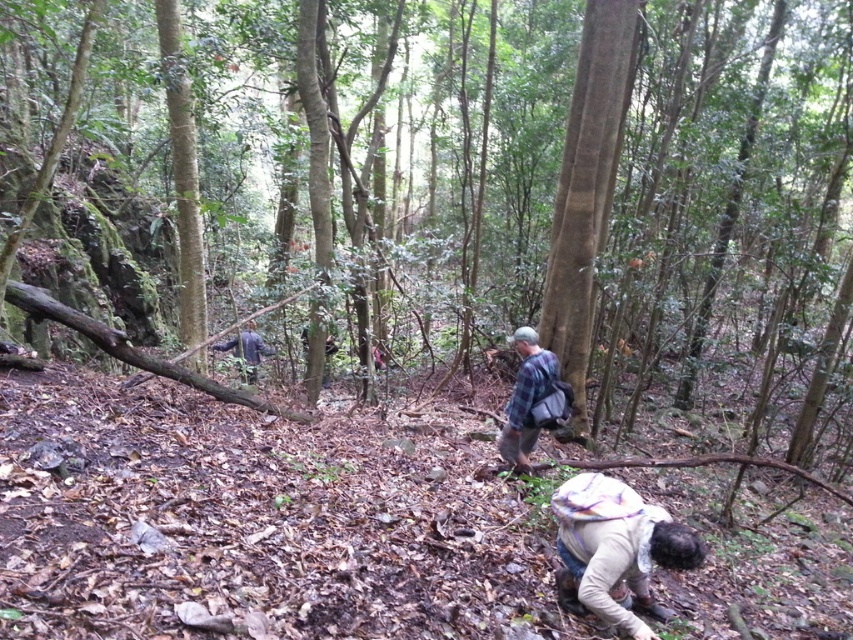
Question: Which object appears closest to the camera in this image?

Choices:
 (A) brown rough tree at center
 (B) light beige fabric backpack at lower center

Answer: (B)

Question: Does brown rough bark tree at center have a larger size compared to plaid fabric shirt at center?

Choices:
 (A) yes
 (B) no

Answer: (A)

Question: Where is brown rough tree at center located in relation to plaid fabric shirt at center in the image?

Choices:
 (A) above
 (B) below

Answer: (A)

Question: Which point is closer to the camera?

Choices:
 (A) light beige fabric backpack at lower center
 (B) plaid fabric shirt at center

Answer: (A)

Question: Which object appears closest to the camera in this image?

Choices:
 (A) plaid fabric shirt at center
 (B) light beige fabric backpack at lower center
 (C) brown rough bark tree at center
 (D) brown rough tree at center

Answer: (B)

Question: Does light beige fabric backpack at lower center appear over plaid fabric shirt at center?

Choices:
 (A) no
 (B) yes

Answer: (A)